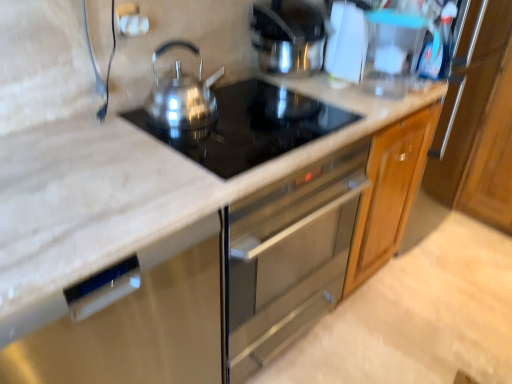
Question: Is satin silver kettle at center, arranged as the 1th kitchen appliance when viewed from the front, further to camera compared to satin silver dishwasher at center?

Choices:
 (A) no
 (B) yes

Answer: (B)

Question: From a real-world perspective, is satin silver kettle at center, which is the first kitchen appliance from left to right, positioned over satin silver dishwasher at center based on gravity?

Choices:
 (A) yes
 (B) no

Answer: (A)

Question: Does satin silver kettle at center, which is the first kitchen appliance from left to right, appear on the left side of satin silver dishwasher at center?

Choices:
 (A) yes
 (B) no

Answer: (B)

Question: Are satin silver kettle at center, which is the first kitchen appliance from left to right, and satin silver dishwasher at center located far from each other?

Choices:
 (A) yes
 (B) no

Answer: (B)

Question: Does satin silver kettle at center, the second kitchen appliance in the back-to-front sequence, touch satin silver dishwasher at center?

Choices:
 (A) yes
 (B) no

Answer: (B)

Question: From the image's perspective, does satin silver kettle at center, which is the second kitchen appliance from right to left, appear lower than satin silver dishwasher at center?

Choices:
 (A) no
 (B) yes

Answer: (A)

Question: Is the position of satin silver kettle at upper center, the 1th kitchen appliance in the back-to-front sequence, more distant than that of satin black cooktop at center?

Choices:
 (A) yes
 (B) no

Answer: (A)

Question: Is satin silver kettle at upper center, which is the second kitchen appliance from front to back, closer to the viewer compared to satin black cooktop at center?

Choices:
 (A) no
 (B) yes

Answer: (A)

Question: Considering the relative positions of satin silver kettle at upper center, the first kitchen appliance positioned from the right, and satin black cooktop at center in the image provided, is satin silver kettle at upper center, the first kitchen appliance positioned from the right, to the right of satin black cooktop at center from the viewer's perspective?

Choices:
 (A) no
 (B) yes

Answer: (B)

Question: Is satin silver kettle at upper center, the second kitchen appliance viewed from the left, wider than satin black cooktop at center?

Choices:
 (A) yes
 (B) no

Answer: (B)

Question: Can you confirm if satin silver kettle at upper center, the first kitchen appliance positioned from the right, is bigger than satin black cooktop at center?

Choices:
 (A) no
 (B) yes

Answer: (B)

Question: From a real-world perspective, is satin silver kettle at upper center, the first kitchen appliance positioned from the right, positioned under satin black cooktop at center based on gravity?

Choices:
 (A) yes
 (B) no

Answer: (B)

Question: Is satin silver kettle at upper center, which is the second kitchen appliance from front to back, surrounded by satin black cooktop at center?

Choices:
 (A) no
 (B) yes

Answer: (A)